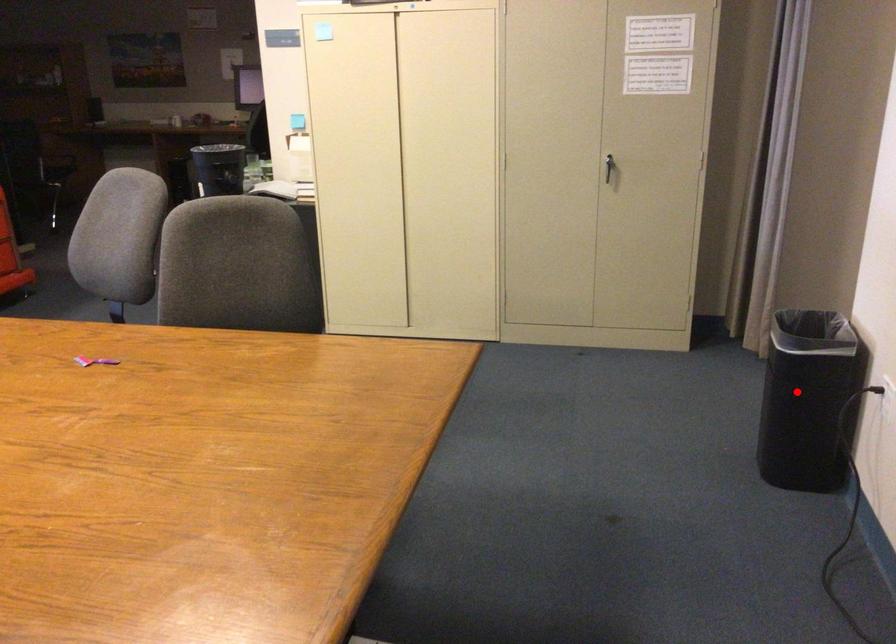
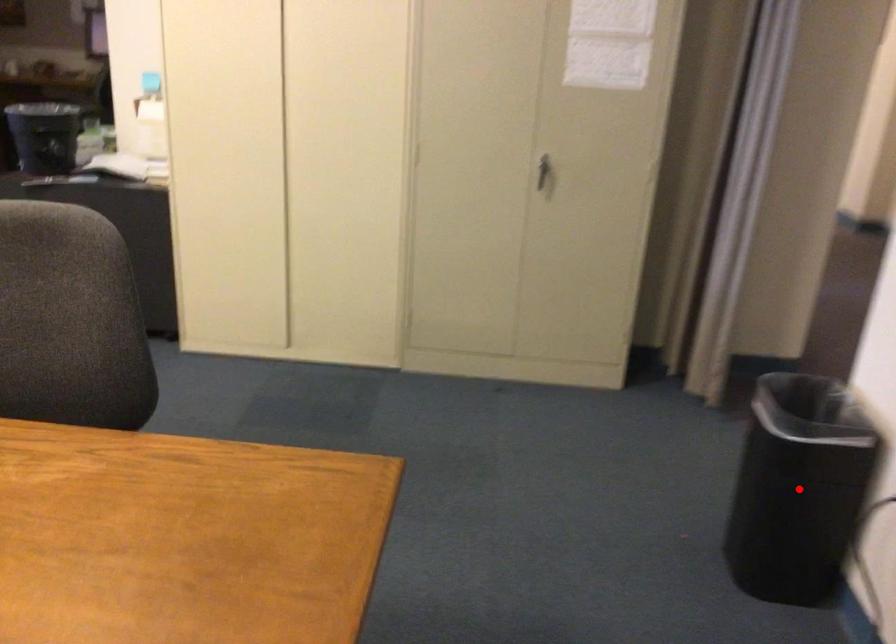
I am providing you with two images of the same scene from different viewpoints. A red point is marked on the first image and another point is marked on the second image. Is the marked point in image1 the same physical position as the marked point in image2?

Yes